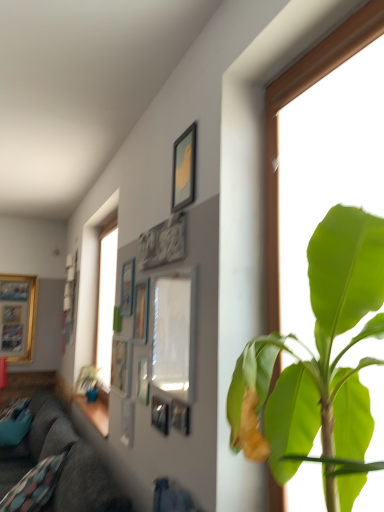
Find the location of a particular element. This screenshot has width=384, height=512. dark gray fabric couch at lower left is located at coordinates 64,464.

How much space does matte white picture frame at center, acting as the 1th picture frame starting from the front, occupy vertically?

It is 20.39 inches.

What do you see at coordinates (127, 288) in the screenshot? The height and width of the screenshot is (512, 384). I see `matte silver picture frame at upper center, the fourth picture frame when ordered from left to right` at bounding box center [127, 288].

Describe the element at coordinates (127, 422) in the screenshot. I see `metallic silver picture frame at center, positioned as the fifth picture frame in left-to-right order` at that location.

You are a GUI agent. You are given a task and a screenshot of the screen. Output one action in this format:
    pyautogui.click(x=<x>, y=<y>)
    Task: Click on the wooden picture frame at upper center, the 6th picture frame from the back
    The width and height of the screenshot is (384, 512).
    Given the screenshot: What is the action you would take?
    pyautogui.click(x=141, y=312)

Identify the location of matte silver picture frame at center, the third picture frame from the left. This screenshot has width=384, height=512. pyautogui.click(x=121, y=365).

Image resolution: width=384 pixels, height=512 pixels. Describe the element at coordinates (121, 365) in the screenshot. I see `matte silver picture frame at center, the third picture frame from the left` at that location.

This screenshot has width=384, height=512. Describe the element at coordinates (86, 379) in the screenshot. I see `wooden picture frame at lower left, which appears as the 11th picture frame when viewed from the front` at that location.

This screenshot has height=512, width=384. I want to click on dark gray fabric couch at lower left, so click(64, 464).

From the image's perspective, relative to gray stone carving at upper center, the fifth picture frame when ordered from right to left, is gold-framed picture at left, acting as the twelfth picture frame starting from the right, above or below?

gold-framed picture at left, acting as the twelfth picture frame starting from the right, is below gray stone carving at upper center, the fifth picture frame when ordered from right to left.

Looking at this image, who is bigger, gold-framed picture at left, the 12th picture frame in the front-to-back sequence, or gray stone carving at upper center, which is the ninth picture frame in back-to-front order?

gold-framed picture at left, the 12th picture frame in the front-to-back sequence, is bigger.

Based on the photo, can you confirm if gold-framed picture at left, acting as the twelfth picture frame starting from the right, is taller than gray stone carving at upper center, the 4th picture frame when ordered from front to back?

Yes.

In the scene shown: From a real-world perspective, is gold-framed picture at left, which is the 1th picture frame from back to front, above or below gray stone carving at upper center, the fifth picture frame when ordered from right to left?

gold-framed picture at left, which is the 1th picture frame from back to front, is below gray stone carving at upper center, the fifth picture frame when ordered from right to left.

Between gray stone carving at upper center, the fifth picture frame when ordered from right to left, and dark gray fabric couch at lower left, which one has more height?

With more height is dark gray fabric couch at lower left.

From the image's perspective, which one is positioned lower, gray stone carving at upper center, marked as the eighth picture frame in a left-to-right arrangement, or dark gray fabric couch at lower left?

dark gray fabric couch at lower left, from the image's perspective.

Locate an element on the screen. The height and width of the screenshot is (512, 384). the 7th picture frame in front of the dark gray fabric couch at lower left is located at coordinates (163, 242).

Which of these two, gray stone carving at upper center, which is the ninth picture frame in back-to-front order, or dark gray fabric couch at lower left, is wider?

Wider between the two is dark gray fabric couch at lower left.

Is matte wood window sill at lower left smaller than matte silver picture frame at center, the third picture frame from the left?

Incorrect, matte wood window sill at lower left is not smaller in size than matte silver picture frame at center, the third picture frame from the left.

Locate an element on the screen. The image size is (384, 512). picture frame that is the 1st object to the right of the matte wood window sill at lower left, starting at the anchor is located at coordinates (121, 365).

Does matte wood window sill at lower left turn towards matte silver picture frame at center, the ninth picture frame in the front-to-back sequence?

No, matte wood window sill at lower left is not aimed at matte silver picture frame at center, the ninth picture frame in the front-to-back sequence.

Looking at this image, would you say matte wood window sill at lower left is outside matte silver picture frame at center, the third picture frame from the left?

Yes, matte wood window sill at lower left is located beyond the bounds of matte silver picture frame at center, the third picture frame from the left.

Is metallic silver picture frame at center, which is counted as the fifth picture frame, starting from the front, not near matte wooden picture frame at upper center, the tenth picture frame positioned from the back?

No.

From a real-world perspective, does metallic silver picture frame at center, marked as the 9th picture frame in a left-to-right arrangement, stand above matte wooden picture frame at upper center, the 12th picture frame in the left-to-right sequence?

No.

Who is taller, metallic silver picture frame at center, marked as the 9th picture frame in a left-to-right arrangement, or matte wooden picture frame at upper center, the first picture frame viewed from the right?

With more height is matte wooden picture frame at upper center, the first picture frame viewed from the right.

From the green leafy plant at upper center, count 2nd picture frames backward and point to it. Please provide its 2D coordinates.

[(180, 416)]

Which object is further away from the camera, metallic silver picture frame at upper center, which is the 11th picture frame from left to right, or green leafy plant at upper center?

metallic silver picture frame at upper center, which is the 11th picture frame from left to right, is further away from the camera.

From the image's perspective, between metallic silver picture frame at upper center, the 11th picture frame viewed from the back, and green leafy plant at upper center, who is located below?

From the image's view, metallic silver picture frame at upper center, the 11th picture frame viewed from the back, is below.

Who is taller, metallic silver picture frame at center, which is counted as the 8th picture frame, starting from the back, or dark gray fabric couch at lower left?

dark gray fabric couch at lower left is taller.

From the picture: Considering the relative sizes of metallic silver picture frame at center, which is counted as the fifth picture frame, starting from the front, and dark gray fabric couch at lower left in the image provided, is metallic silver picture frame at center, which is counted as the fifth picture frame, starting from the front, smaller than dark gray fabric couch at lower left?

Yes, metallic silver picture frame at center, which is counted as the fifth picture frame, starting from the front, is smaller than dark gray fabric couch at lower left.

Is metallic silver picture frame at center, which is counted as the 8th picture frame, starting from the back, inside or outside of dark gray fabric couch at lower left?

metallic silver picture frame at center, which is counted as the 8th picture frame, starting from the back, cannot be found inside dark gray fabric couch at lower left.

Is metallic silver picture frame at center, which is counted as the 4th picture frame, starting from the right, directly adjacent to dark gray fabric couch at lower left?

No, metallic silver picture frame at center, which is counted as the 4th picture frame, starting from the right, is not making contact with dark gray fabric couch at lower left.

Which object is more forward, metallic silver picture frame at upper center, the 11th picture frame viewed from the back, or dark gray fabric couch at lower left?

metallic silver picture frame at upper center, the 11th picture frame viewed from the back.

Is metallic silver picture frame at upper center, the 11th picture frame viewed from the back, placed right next to dark gray fabric couch at lower left?

No, metallic silver picture frame at upper center, the 11th picture frame viewed from the back, is not with dark gray fabric couch at lower left.

From a real-world perspective, between metallic silver picture frame at upper center, which is the 11th picture frame from left to right, and dark gray fabric couch at lower left, who is vertically higher?

In real-world perspective, metallic silver picture frame at upper center, which is the 11th picture frame from left to right, is above.

From the image's perspective, is metallic silver picture frame at upper center, positioned as the second picture frame in right-to-left order, below dark gray fabric couch at lower left?

No.

From a real-world perspective, starting from the gold-framed picture at left, the 12th picture frame in the front-to-back sequence, which picture frame is the 3rd one vertically above it? Please provide its 2D coordinates.

[(163, 242)]

Where is `the 7th picture frame in front of the dark gray fabric couch at lower left`? the 7th picture frame in front of the dark gray fabric couch at lower left is located at coordinates (163, 242).

Looking at the image, which one is located closer to green leafy plant at upper center, metallic silver picture frame at center, which is counted as the 4th picture frame, starting from the right, or matte wood window sill at lower left?

The object closer to green leafy plant at upper center is metallic silver picture frame at center, which is counted as the 4th picture frame, starting from the right.

Considering their positions, is metallic silver picture frame at upper center, which is the 2th picture frame in front-to-back order, positioned closer to gray stone carving at upper center, which is the ninth picture frame in back-to-front order, than wooden picture frame at lower left, arranged as the eleventh picture frame when viewed from the right?

metallic silver picture frame at upper center, which is the 2th picture frame in front-to-back order, is closer to gray stone carving at upper center, which is the ninth picture frame in back-to-front order.

Looking at the image, which one is located further to dark gray fabric couch at lower left, metallic silver picture frame at center, positioned as the fifth picture frame in left-to-right order, or metallic silver picture frame at center, which is counted as the 4th picture frame, starting from the right?

metallic silver picture frame at center, which is counted as the 4th picture frame, starting from the right.

Which object lies further to the anchor point wooden picture frame at upper center, which ranks as the 7th picture frame in front-to-back order, metallic silver picture frame at center, positioned as the fifth picture frame in left-to-right order, or metallic silver picture frame at center, marked as the 9th picture frame in a left-to-right arrangement?

metallic silver picture frame at center, marked as the 9th picture frame in a left-to-right arrangement, lies further to wooden picture frame at upper center, which ranks as the 7th picture frame in front-to-back order, than the other object.

When comparing their distances from dark gray fabric couch at lower left, does wooden picture frame at lower left, which ranks as the 2th picture frame in left-to-right order, or metallic silver picture frame at upper center, which is the 2th picture frame in front-to-back order, seem further?

wooden picture frame at lower left, which ranks as the 2th picture frame in left-to-right order.

Based on their spatial positions, is matte wooden picture frame at upper center, the third picture frame positioned from the front, or matte wood window sill at lower left closer to gold-framed picture at left, acting as the twelfth picture frame starting from the right?

matte wood window sill at lower left is positioned closer to the anchor gold-framed picture at left, acting as the twelfth picture frame starting from the right.

Which object lies nearer to the anchor point matte wood window sill at lower left, metallic silver picture frame at center, the fifth picture frame from the back, or matte white picture frame at center, acting as the 1th picture frame starting from the front?

metallic silver picture frame at center, the fifth picture frame from the back, lies closer to matte wood window sill at lower left than the other object.

Based on their spatial positions, is metallic silver picture frame at center, the 8th picture frame from the right, or dark gray fabric couch at lower left closer to matte wood window sill at lower left?

dark gray fabric couch at lower left is closer to matte wood window sill at lower left.

You are a GUI agent. You are given a task and a screenshot of the screen. Output one action in this format:
    pyautogui.click(x=<x>, y=<y>)
    Task: Click on the window sill positioned between green leafy plant at upper center and wooden picture frame at lower left, arranged as the eleventh picture frame when viewed from the right, from near to far
    
    Given the screenshot: What is the action you would take?
    pyautogui.click(x=96, y=411)

The image size is (384, 512). I want to click on window sill between matte silver picture frame at upper center, the fourth picture frame when ordered from left to right, and gold-framed picture at left, acting as the twelfth picture frame starting from the right, along the z-axis, so click(x=96, y=411).

The width and height of the screenshot is (384, 512). Find the location of `studio couch positioned between matte white picture frame at center, acting as the 12th picture frame starting from the back, and gold-framed picture at left, the first picture frame viewed from the left, from near to far`. studio couch positioned between matte white picture frame at center, acting as the 12th picture frame starting from the back, and gold-framed picture at left, the first picture frame viewed from the left, from near to far is located at coordinates (64, 464).

You are a GUI agent. You are given a task and a screenshot of the screen. Output one action in this format:
    pyautogui.click(x=<x>, y=<y>)
    Task: Click on the studio couch between matte silver picture frame at upper center, the fourth picture frame when ordered from left to right, and gold-framed picture at left, the first picture frame viewed from the left, along the z-axis
    Image resolution: width=384 pixels, height=512 pixels.
    Given the screenshot: What is the action you would take?
    pyautogui.click(x=64, y=464)